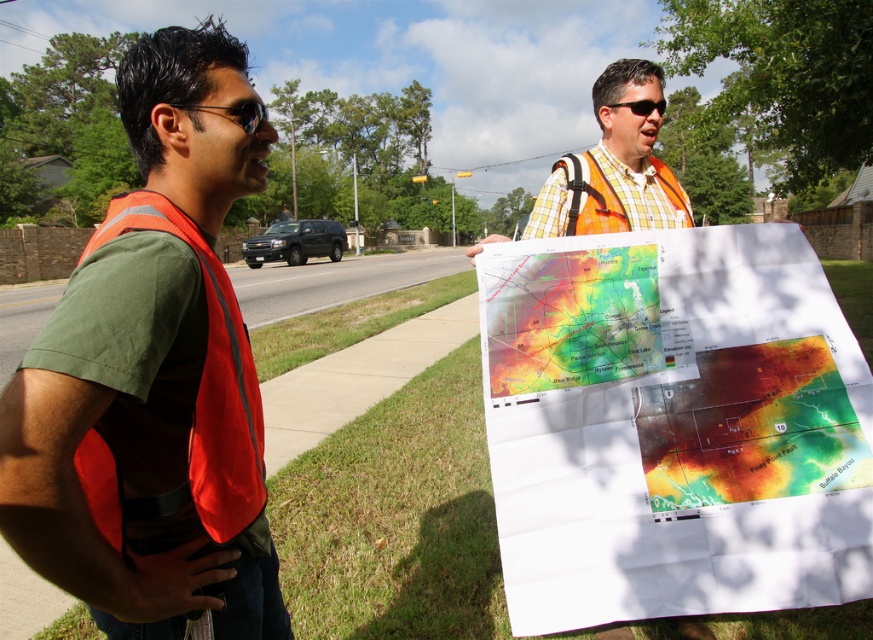
Question: Which of the following is the closest to the observer?

Choices:
 (A) (550, 275)
 (B) (652, 209)
 (C) (243, 124)

Answer: (C)

Question: Which point appears farthest from the camera in this image?

Choices:
 (A) (238, 326)
 (B) (629, 102)
 (C) (775, 356)

Answer: (B)

Question: Observing the image, what is the correct spatial positioning of matte paper map at center in reference to thermal map at center?

Choices:
 (A) above
 (B) below

Answer: (B)

Question: Which point appears farthest from the camera in this image?

Choices:
 (A) (115, 211)
 (B) (256, 109)

Answer: (B)

Question: Is watercolor map at center bigger than matte paper map at center?

Choices:
 (A) yes
 (B) no

Answer: (A)

Question: Is watercolor map at center in front of orange reflective vest at left?

Choices:
 (A) yes
 (B) no

Answer: (B)